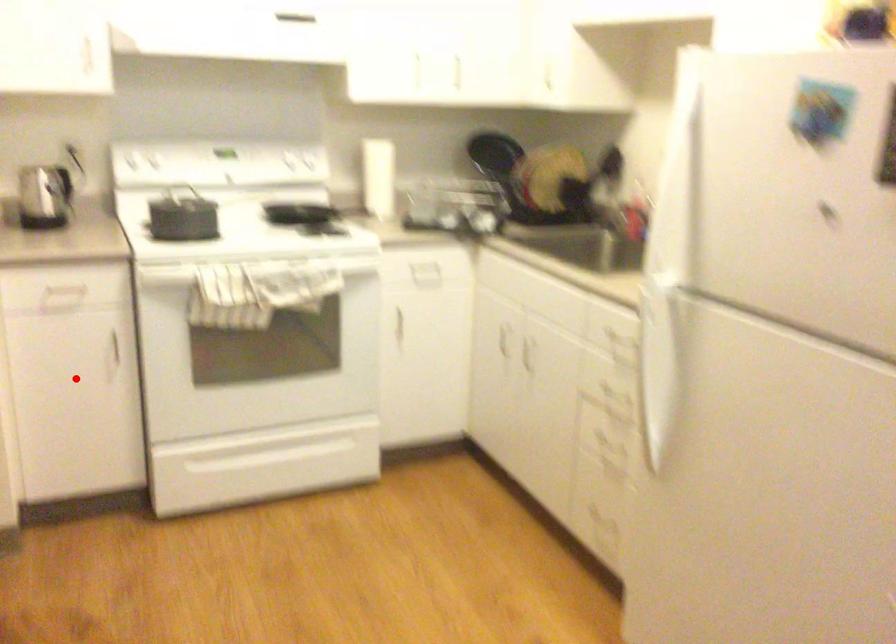
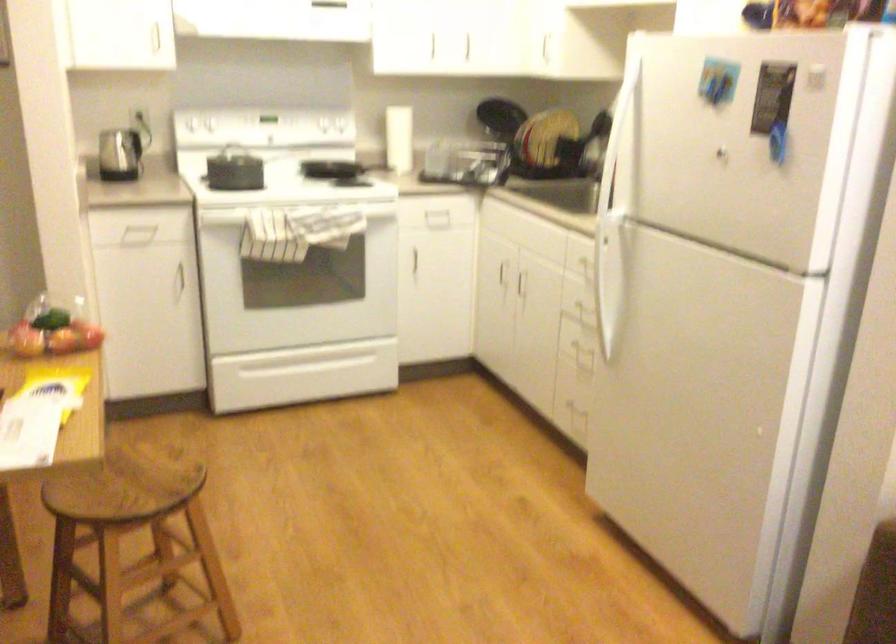
Question: I am providing you with two images of the same scene from different viewpoints. A red point is marked on the first image. Is the red point's position out of view in image 2?

Choices:
 (A) Yes
 (B) No

Answer: (B)